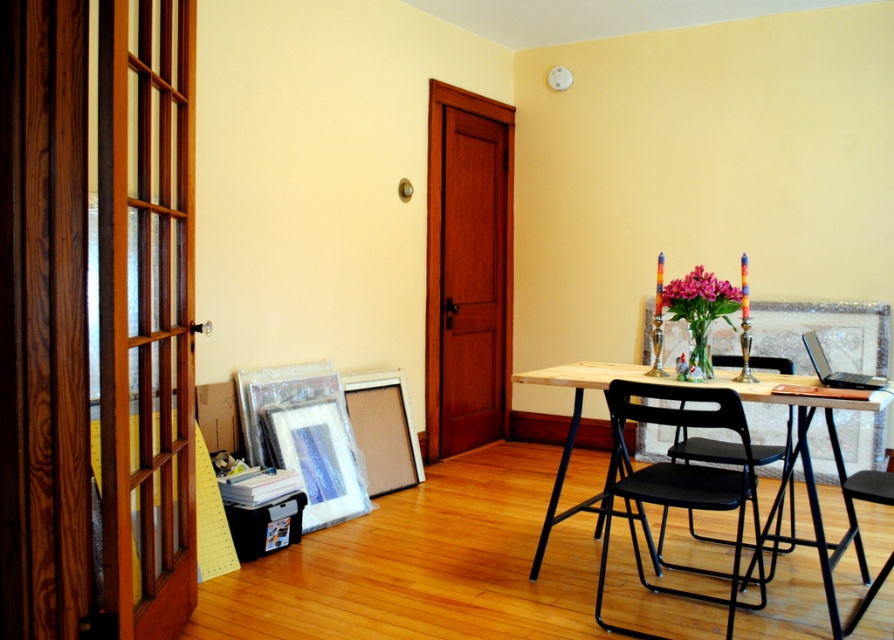
Question: Can you confirm if wooden table at center is bigger than pink glossy flowers at center?

Choices:
 (A) no
 (B) yes

Answer: (B)

Question: Estimate the real-world distances between objects in this image. Which object is closer to the pink glossy flowers at center?

Choices:
 (A) black plastic chair at right
 (B) black metal chair at lower right

Answer: (B)

Question: Which point appears closest to the camera in this image?

Choices:
 (A) (696, 269)
 (B) (724, 449)
 (C) (542, 369)

Answer: (A)

Question: Is wooden table at center above pink glossy flowers at center?

Choices:
 (A) yes
 (B) no

Answer: (B)

Question: Which is nearer to the black metal chair at lower right?

Choices:
 (A) black plastic chair at right
 (B) wooden table at center
 (C) black plastic chair at center
 (D) pink glossy flowers at center

Answer: (B)

Question: Does wooden table at center come behind black plastic chair at right?

Choices:
 (A) yes
 (B) no

Answer: (B)